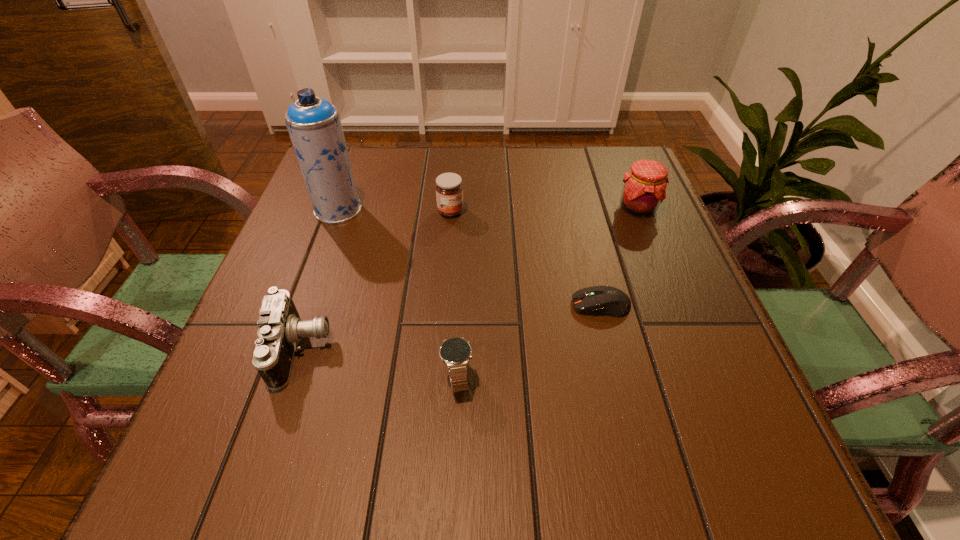
This screenshot has width=960, height=540. In order to click on jam located in the right edge section of the desktop in this screenshot , I will do `click(644, 188)`.

Identify the location of computer equipment that is at the right edge. This screenshot has height=540, width=960. (607, 300).

Locate an element on the screen. This screenshot has height=540, width=960. object present at the far left corner is located at coordinates (314, 126).

Where is `object situated at the far right corner`? Image resolution: width=960 pixels, height=540 pixels. object situated at the far right corner is located at coordinates (644, 188).

You are a GUI agent. You are given a task and a screenshot of the screen. Output one action in this format:
    pyautogui.click(x=<x>, y=<y>)
    Task: Click on the free space at the far edge of the desktop
    
    Given the screenshot: What is the action you would take?
    pyautogui.click(x=532, y=148)

This screenshot has width=960, height=540. Find the location of `vacant region at the near edge of the desktop`. vacant region at the near edge of the desktop is located at coordinates pyautogui.click(x=306, y=465).

Locate an element on the screen. The height and width of the screenshot is (540, 960). blank space at the left edge of the desktop is located at coordinates (281, 256).

Find the location of a particular element. This screenshot has width=960, height=540. free space at the right edge is located at coordinates (609, 206).

Locate an element on the screen. The height and width of the screenshot is (540, 960). vacant space at the far right corner of the desktop is located at coordinates (612, 166).

At what (x,y) coordinates should I click in order to perform the action: click on unoccupied position between the watch and the fifth object from left to right. Please return your answer as a coordinate pair (x, y). Looking at the image, I should click on coord(529,341).